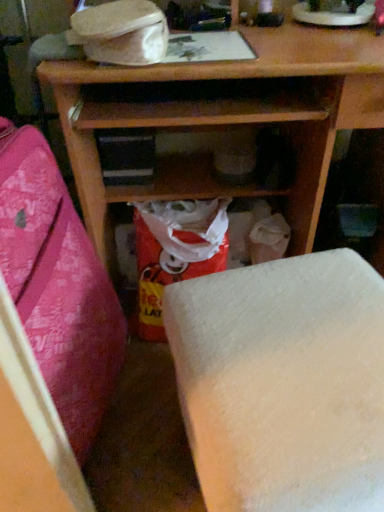
Question: In the image, is matte plastic bag at center positioned in front of or behind wooden shelf at center, which ranks as the 2th furniture in right-to-left order?

Choices:
 (A) behind
 (B) front

Answer: (A)

Question: From the image's perspective, is matte plastic bag at center located above or below wooden shelf at center, marked as the first furniture in a left-to-right arrangement?

Choices:
 (A) above
 (B) below

Answer: (A)

Question: Which object is positioned farthest from the matte plastic bag at center?

Choices:
 (A) white matte foam at lower center, placed as the first furniture when sorted from right to left
 (B) wooden shelf at center, which ranks as the 2th furniture in right-to-left order

Answer: (A)

Question: Which of these objects is positioned closest to the wooden shelf at center, which ranks as the 2th furniture in right-to-left order?

Choices:
 (A) white matte foam at lower center, placed as the first furniture when sorted from right to left
 (B) matte plastic bag at center

Answer: (B)